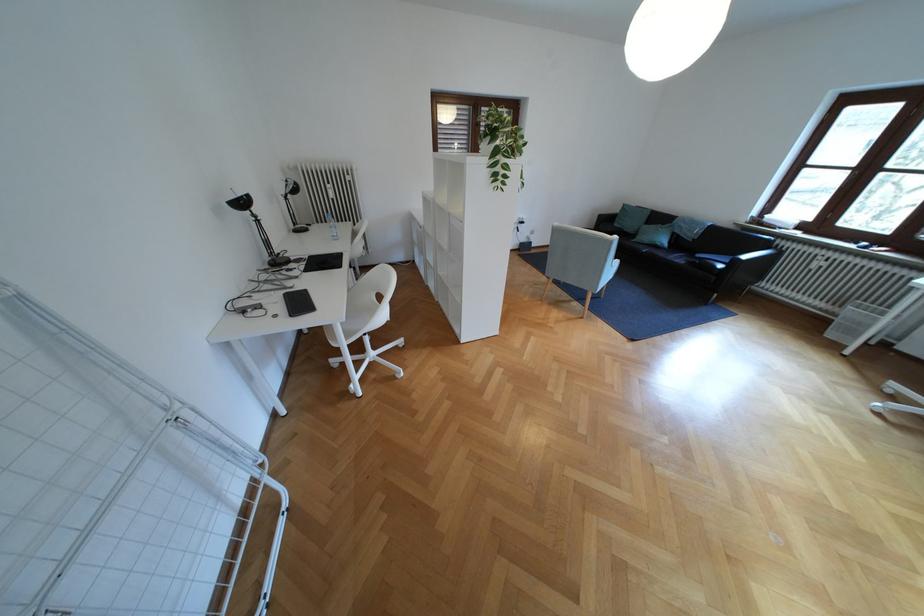
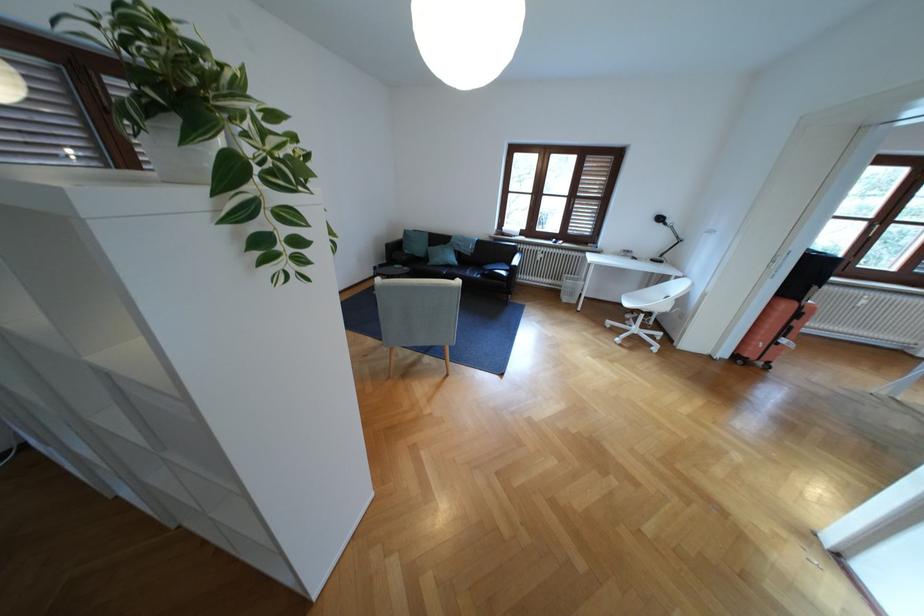
In the second image, find the point that corresponds to point (835, 312) in the first image.

(563, 285)